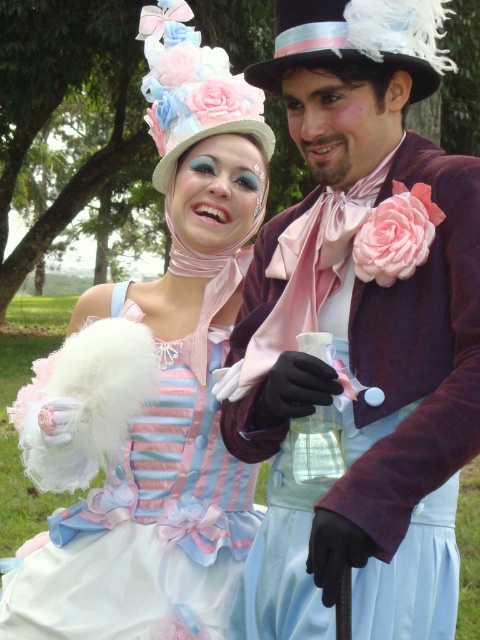
You are a costume designer preparing for a play and need to ensure the matte purple coat at center and the black felt dress hat at upper center fit on a mannequin. Given that the mannequin has limited space between its shoulders and head, which item might not fit due to size?

The matte purple coat at center is bigger than the black felt dress hat at upper center, so the matte purple coat at center might not fit on the mannequin due to its larger size.

You are standing in front of the image and notice a specific point at coordinates (360, 332). Which object in the scene does this point belong to?

The point at coordinates (360, 332) belongs to the matte purple coat at center.

You are a photographer standing at the camera position. You want to take a closeup shot of the matte purple coat at center. What is the minimum distance you need to move forward to get the coat into focus if your camera has a minimum focusing distance of 1.5 meters?

The matte purple coat at center is currently 1.85 meters away from the camera. Since the camera requires a minimum focusing distance of 1.5 meters, you need to move forward by 0.35 meters to get the matte purple coat at center into focus.